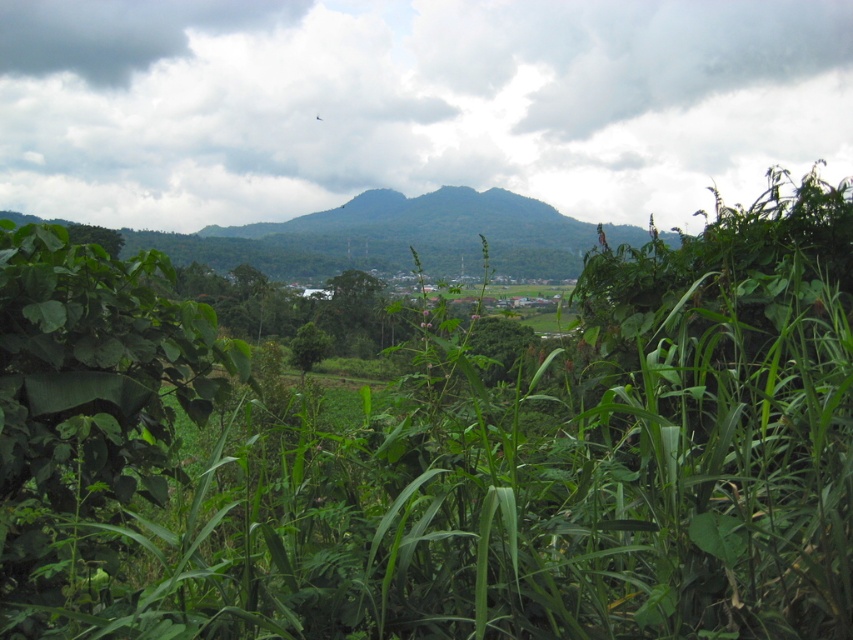
Is point (785, 628) positioned before point (16, 186)?

That is True.

Which is in front, point (791, 497) or point (283, 24)?

Positioned in front is point (791, 497).

Is point (378, 532) positioned in front of point (546, 38)?

Yes, point (378, 532) is in front of point (546, 38).

Find the location of a particular element. green leafy jungle at center is located at coordinates (439, 449).